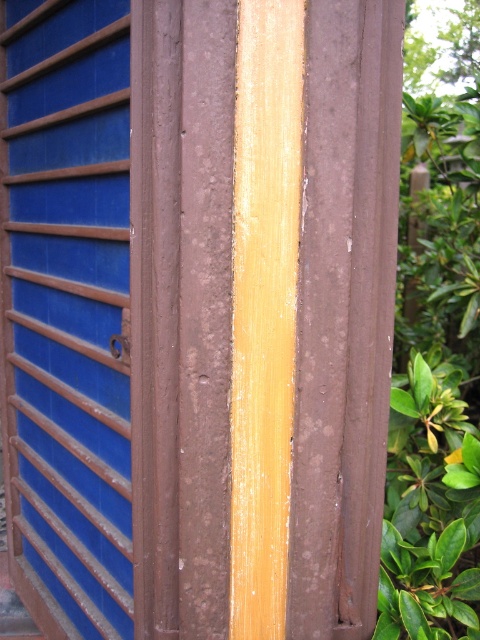
Between blue painted wood door at left and yellow polished wood at center, which one has more height?

blue painted wood door at left is taller.

Describe the element at coordinates (68, 310) in the screenshot. This screenshot has height=640, width=480. I see `blue painted wood door at left` at that location.

Locate an element on the screen. Image resolution: width=480 pixels, height=640 pixels. blue painted wood door at left is located at coordinates (68, 310).

Who is shorter, blue painted wood door at left or brown matte wood at center?

Standing shorter between the two is brown matte wood at center.

Is point (66, 170) less distant than point (288, 588)?

No, (66, 170) is behind (288, 588).

Find the location of a particular element. blue painted wood door at left is located at coordinates (68, 310).

Locate an element on the screen. This screenshot has height=640, width=480. blue painted wood door at left is located at coordinates (68, 310).

Does brown matte wood at center have a smaller size compared to yellow polished wood at center?

Actually, brown matte wood at center might be larger than yellow polished wood at center.

Can you confirm if brown matte wood at center is positioned to the left of yellow polished wood at center?

Incorrect, brown matte wood at center is not on the left side of yellow polished wood at center.

This screenshot has width=480, height=640. Find the location of `brown matte wood at center`. brown matte wood at center is located at coordinates (344, 314).

At what (x,y) coordinates should I click in order to perform the action: click on brown matte wood at center. Please return your answer as a coordinate pair (x, y). The height and width of the screenshot is (640, 480). Looking at the image, I should click on (344, 314).